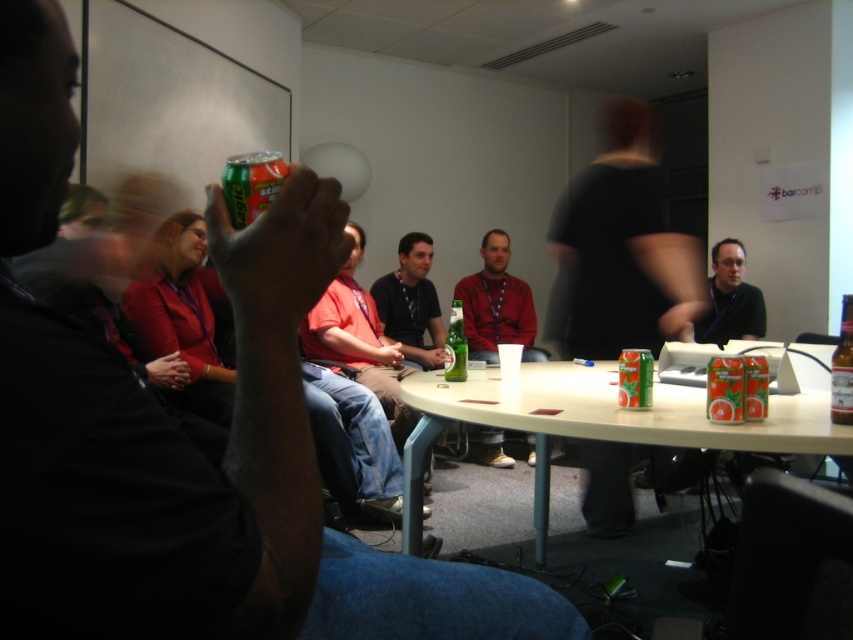
You are standing at the center of the room and want to hand a document to the person wearing the matte black shirt at lower right. Based on their position, in which direction should you move to reach them?

The matte black shirt at lower right is located at point 0.469 on the x axis and 0.857 on the y axis. Since you are at the center, you should move towards the lower right direction to reach them.